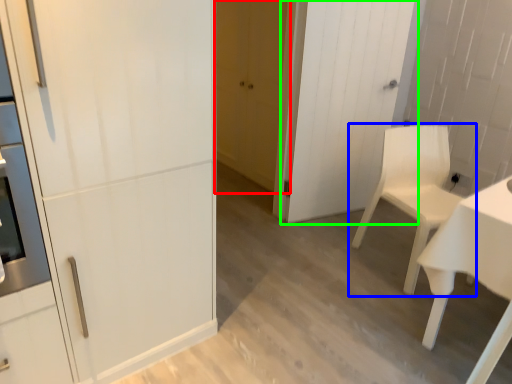
Question: Based on their relative distances, which object is farther from door (highlighted by a red box)? Choose from chair (highlighted by a blue box) and door (highlighted by a green box).

Choices:
 (A) chair
 (B) door

Answer: (A)